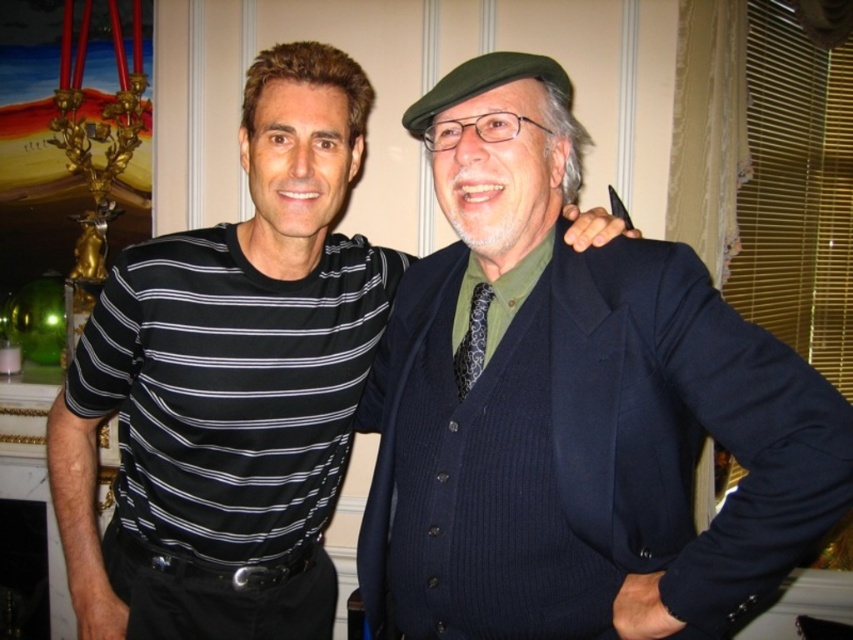
You are standing in the room and want to place a small plant between the two points, point (680, 429) and point (279, 45). Which point should the plant be closer to so it is nearer to the front of the room?

The plant should be closer to point (680, 429) because it is in front of point (279, 45).

In the image, there are two people standing close together. The person wearing the dark blue textured suit at center is standing to the right of the person in the black striped shirt at center. Which person is positioned to the left?

The person wearing the black striped shirt at center is positioned to the left since the dark blue textured suit at center is to its right.